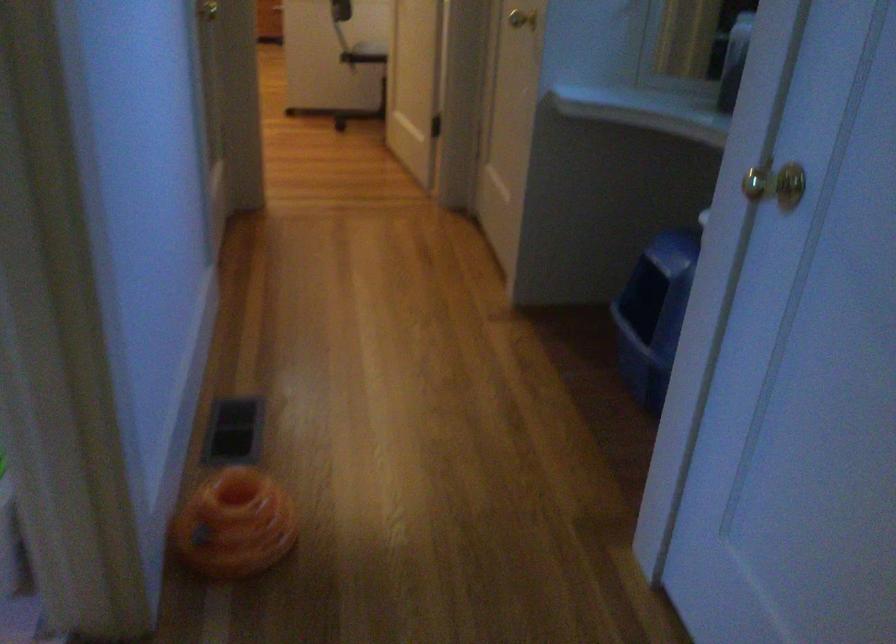
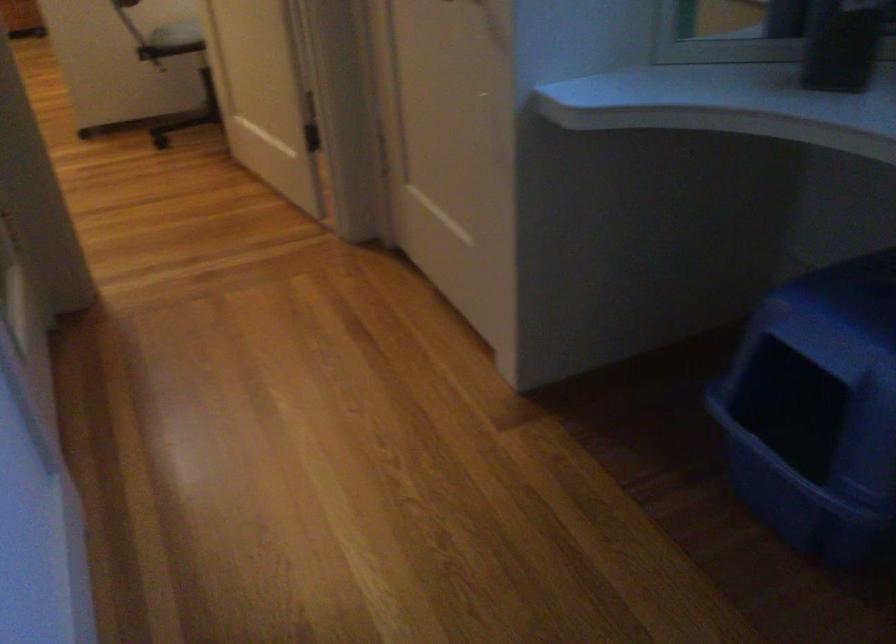
Question: Based on the continuous images, in which direction is the camera rotating? Reply with the corresponding letter.

Choices:
 (A) Left
 (B) Right
 (C) Up
 (D) Down

Answer: (B)